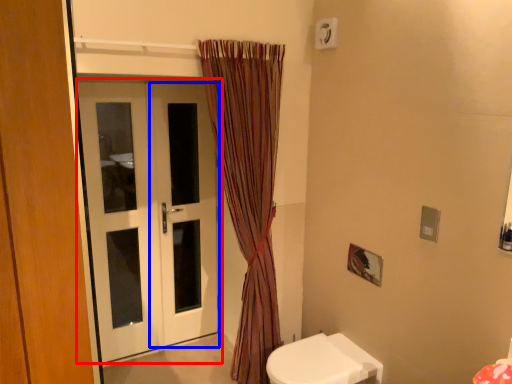
Question: Among these objects, which one is nearest to the camera, door (highlighted by a red box) or screen door (highlighted by a blue box)?

Choices:
 (A) door
 (B) screen door

Answer: (A)